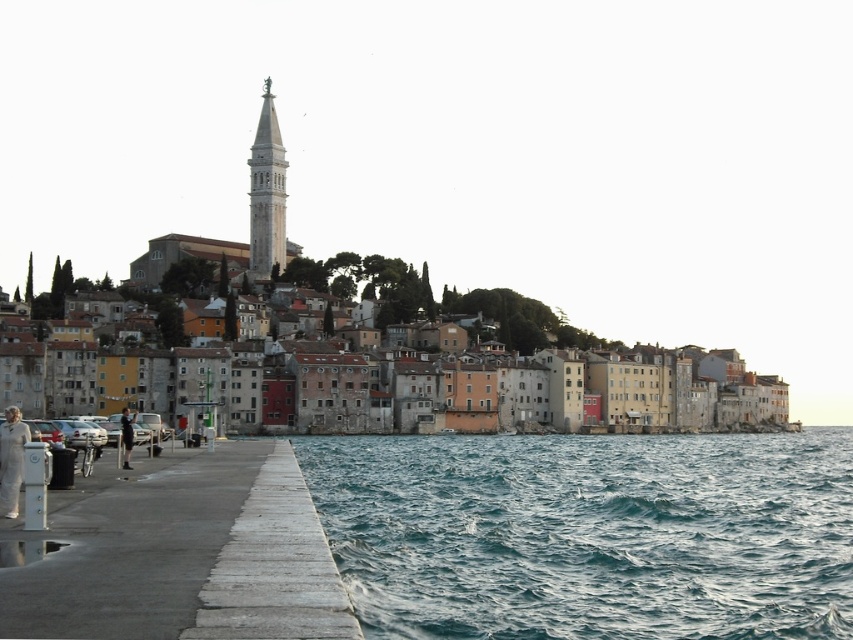
Question: Where is multicolored stone buildings at center located in relation to white stone tower at upper center in the image?

Choices:
 (A) above
 (B) below

Answer: (B)

Question: Which object is positioned farthest from the multicolored stone buildings at center?

Choices:
 (A) white concrete dock at lower left
 (B) white stone tower at upper center
 (C) teal water at lower right

Answer: (A)

Question: Is teal water at lower right closer to the viewer compared to white concrete dock at lower left?

Choices:
 (A) no
 (B) yes

Answer: (A)

Question: Based on their relative distances, which object is farther from the multicolored stone buildings at center?

Choices:
 (A) teal water at lower right
 (B) white concrete dock at lower left
 (C) white stone tower at upper center

Answer: (B)

Question: Which point is closer to the camera?

Choices:
 (A) (471, 316)
 (B) (271, 481)
 (C) (532, 529)

Answer: (B)

Question: Is teal water at lower right thinner than white concrete dock at lower left?

Choices:
 (A) yes
 (B) no

Answer: (B)